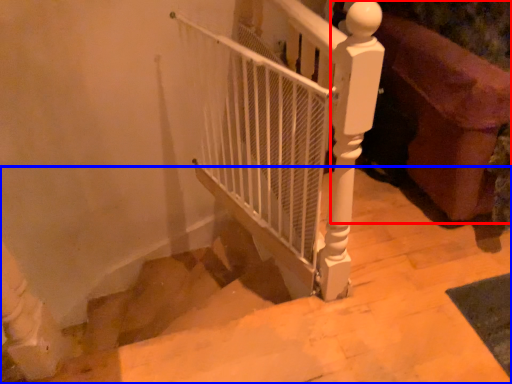
Question: Which object appears farthest to the camera in this image, furniture (highlighted by a red box) or stairs (highlighted by a blue box)?

Choices:
 (A) furniture
 (B) stairs

Answer: (A)